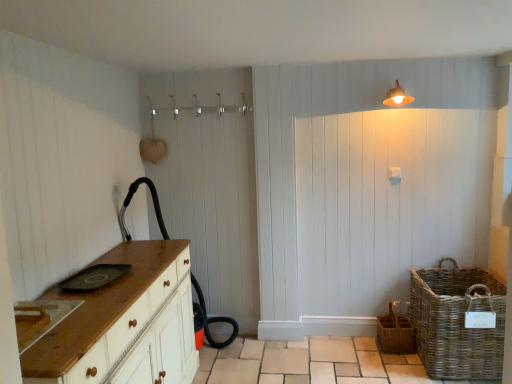
The width and height of the screenshot is (512, 384). What do you see at coordinates (98, 306) in the screenshot?
I see `wooden chest of drawers at left` at bounding box center [98, 306].

Locate an element on the screen. woven brown basket at lower right, which is counted as the 1th basket, starting from the right is located at coordinates tap(457, 322).

You are a GUI agent. You are given a task and a screenshot of the screen. Output one action in this format:
    pyautogui.click(x=<x>, y=<y>)
    Task: Click on the wooden chest of drawers at left
    This screenshot has height=384, width=512.
    Given the screenshot: What is the action you would take?
    pyautogui.click(x=98, y=306)

Can you confirm if matte white light fixture at upper right is taller than wooden chest of drawers at left?

No, matte white light fixture at upper right is not taller than wooden chest of drawers at left.

From a real-world perspective, is matte white light fixture at upper right on top of wooden chest of drawers at left?

Yes, from a real-world perspective, matte white light fixture at upper right is over wooden chest of drawers at left

Is wooden chest of drawers at left a part of matte white light fixture at upper right?

Actually, wooden chest of drawers at left is outside matte white light fixture at upper right.

Find the location of a particular element. light fixture that appears behind the wooden chest of drawers at left is located at coordinates (397, 96).

Based on the photo, can you tell me how much woven brown basket at lower right, the 2th basket when ordered from left to right, and woven wicker basket at lower right, acting as the 2th basket starting from the right, differ in facing direction?

woven brown basket at lower right, the 2th basket when ordered from left to right, and woven wicker basket at lower right, acting as the 2th basket starting from the right, are facing 0.357 degrees away from each other.

Considering the relative sizes of woven brown basket at lower right, which is counted as the 1th basket, starting from the right, and woven wicker basket at lower right, positioned as the 1th basket in left-to-right order, in the image provided, is woven brown basket at lower right, which is counted as the 1th basket, starting from the right, bigger than woven wicker basket at lower right, positioned as the 1th basket in left-to-right order,?

Yes.

Considering their positions, is woven brown basket at lower right, which is counted as the 1th basket, starting from the right, located in front of or behind woven wicker basket at lower right, acting as the 2th basket starting from the right?

In the image, woven brown basket at lower right, which is counted as the 1th basket, starting from the right, appears in front of woven wicker basket at lower right, acting as the 2th basket starting from the right.

Which is more to the right, woven brown basket at lower right, the 2th basket when ordered from left to right, or woven wicker basket at lower right, positioned as the 1th basket in left-to-right order?

woven brown basket at lower right, the 2th basket when ordered from left to right, is more to the right.

Does wooden chest of drawers at left turn towards woven wicker basket at lower right, acting as the 2th basket starting from the right?

Yes, wooden chest of drawers at left is turned towards woven wicker basket at lower right, acting as the 2th basket starting from the right.

Does wooden chest of drawers at left appear on the right side of woven wicker basket at lower right, acting as the 2th basket starting from the right?

No, wooden chest of drawers at left is not to the right of woven wicker basket at lower right, acting as the 2th basket starting from the right.

Would you say wooden chest of drawers at left is inside or outside woven wicker basket at lower right, acting as the 2th basket starting from the right?

The correct answer is: outside.

Is point (110, 288) closer or farther from the camera than point (378, 341)?

Point (110, 288) appears to be closer to the viewer than point (378, 341).

Is point (388, 96) closer to viewer compared to point (409, 330)?

No.

Looking at the image, does matte white light fixture at upper right seem bigger or smaller compared to woven wicker basket at lower right, positioned as the 1th basket in left-to-right order?

Considering their sizes, matte white light fixture at upper right takes up less space than woven wicker basket at lower right, positioned as the 1th basket in left-to-right order.

Image resolution: width=512 pixels, height=384 pixels. What are the coordinates of `light fixture that appears on the left of woven wicker basket at lower right, positioned as the 1th basket in left-to-right order` in the screenshot? It's located at (397, 96).

Based on the photo, from the image's perspective, is wooden chest of drawers at left below woven brown basket at lower right, the 2th basket when ordered from left to right?

Yes, from the image's perspective, wooden chest of drawers at left is below woven brown basket at lower right, the 2th basket when ordered from left to right.

Is wooden chest of drawers at left facing away from woven brown basket at lower right, which is counted as the 1th basket, starting from the right?

No.

Based on the photo, is wooden chest of drawers at left spatially inside woven brown basket at lower right, the 2th basket when ordered from left to right, or outside of it?

wooden chest of drawers at left lies outside woven brown basket at lower right, the 2th basket when ordered from left to right.

Is woven wicker basket at lower right, positioned as the 1th basket in left-to-right order, thinner than wooden chest of drawers at left?

Correct, the width of woven wicker basket at lower right, positioned as the 1th basket in left-to-right order, is less than that of wooden chest of drawers at left.

Is point (411, 341) positioned behind point (35, 348)?

Yes, point (411, 341) is behind point (35, 348).

From a real-world perspective, count 2nd baskets downward from the wooden chest of drawers at left and point to it. Please provide its 2D coordinates.

[(395, 332)]

Measure the distance from woven wicker basket at lower right, positioned as the 1th basket in left-to-right order, to wooden chest of drawers at left.

woven wicker basket at lower right, positioned as the 1th basket in left-to-right order, is 1.81 meters from wooden chest of drawers at left.

From a real-world perspective, which object stands above the other?

matte white light fixture at upper right.

From the image's perspective, is wooden chest of drawers at left below matte white light fixture at upper right?

Yes, from the image's perspective, wooden chest of drawers at left is beneath matte white light fixture at upper right.

Which of these two, wooden chest of drawers at left or matte white light fixture at upper right, is wider?

wooden chest of drawers at left is wider.

Are wooden chest of drawers at left and matte white light fixture at upper right far apart?

Absolutely, wooden chest of drawers at left is distant from matte white light fixture at upper right.

What are the coordinates of `chest of drawers on the left of matte white light fixture at upper right` in the screenshot? It's located at (98, 306).

Locate an element on the screen. This screenshot has width=512, height=384. basket behind the woven brown basket at lower right, which is counted as the 1th basket, starting from the right is located at coordinates (395, 332).

Looking at this image, based on their spatial positions, is woven brown basket at lower right, which is counted as the 1th basket, starting from the right, or matte white light fixture at upper right further from woven wicker basket at lower right, acting as the 2th basket starting from the right?

The object further to woven wicker basket at lower right, acting as the 2th basket starting from the right, is matte white light fixture at upper right.

Based on the photo, which object lies further to the anchor point matte white light fixture at upper right, woven wicker basket at lower right, positioned as the 1th basket in left-to-right order, or woven brown basket at lower right, which is counted as the 1th basket, starting from the right?

woven wicker basket at lower right, positioned as the 1th basket in left-to-right order.

Looking at this image, which object lies nearer to the anchor point matte white light fixture at upper right, woven brown basket at lower right, which is counted as the 1th basket, starting from the right, or woven wicker basket at lower right, acting as the 2th basket starting from the right?

woven brown basket at lower right, which is counted as the 1th basket, starting from the right, lies closer to matte white light fixture at upper right than the other object.

Estimate the real-world distances between objects in this image. Which object is closer to matte white light fixture at upper right, wooden chest of drawers at left or woven brown basket at lower right, the 2th basket when ordered from left to right?

woven brown basket at lower right, the 2th basket when ordered from left to right, is closer to matte white light fixture at upper right.

From the image, which object appears to be farther from woven wicker basket at lower right, positioned as the 1th basket in left-to-right order, woven brown basket at lower right, which is counted as the 1th basket, starting from the right, or wooden chest of drawers at left?

The object further to woven wicker basket at lower right, positioned as the 1th basket in left-to-right order, is wooden chest of drawers at left.

Consider the image. Considering their positions, is woven brown basket at lower right, the 2th basket when ordered from left to right, positioned further to wooden chest of drawers at left than woven wicker basket at lower right, positioned as the 1th basket in left-to-right order?

Among the two, woven brown basket at lower right, the 2th basket when ordered from left to right, is located further to wooden chest of drawers at left.

From the image, which object appears to be nearer to woven brown basket at lower right, the 2th basket when ordered from left to right, matte white light fixture at upper right or woven wicker basket at lower right, positioned as the 1th basket in left-to-right order?

woven wicker basket at lower right, positioned as the 1th basket in left-to-right order, is closer to woven brown basket at lower right, the 2th basket when ordered from left to right.

Which object lies further to the anchor point matte white light fixture at upper right, wooden chest of drawers at left or woven wicker basket at lower right, positioned as the 1th basket in left-to-right order?

Based on the image, wooden chest of drawers at left appears to be further to matte white light fixture at upper right.

Where is `basket between wooden chest of drawers at left and woven brown basket at lower right, the 2th basket when ordered from left to right, in the horizontal direction`? This screenshot has height=384, width=512. basket between wooden chest of drawers at left and woven brown basket at lower right, the 2th basket when ordered from left to right, in the horizontal direction is located at coordinates pos(395,332).

The width and height of the screenshot is (512, 384). In order to click on basket between matte white light fixture at upper right and woven wicker basket at lower right, positioned as the 1th basket in left-to-right order, in the up-down direction in this screenshot , I will do `click(457, 322)`.

Locate an element on the screen. The image size is (512, 384). light fixture between wooden chest of drawers at left and woven brown basket at lower right, which is counted as the 1th basket, starting from the right is located at coordinates (397, 96).

Locate an element on the screen. This screenshot has width=512, height=384. light fixture between wooden chest of drawers at left and woven wicker basket at lower right, acting as the 2th basket starting from the right is located at coordinates (397, 96).